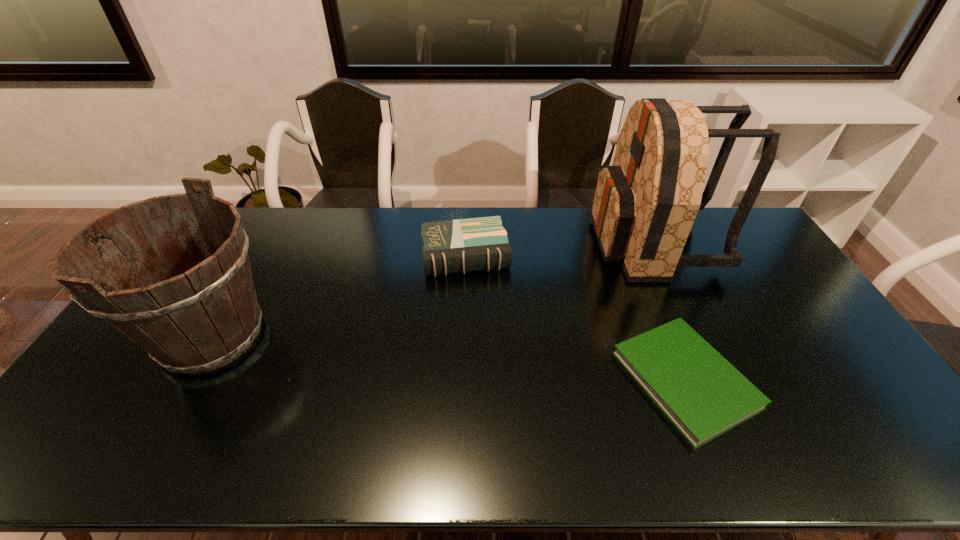
At what (x,y) coordinates should I click in order to perform the action: click on object that stands as the third closest to the third shortest object. Please return your answer as a coordinate pair (x, y). The image size is (960, 540). Looking at the image, I should click on (645, 204).

Where is `free space that satisfies the following two spatial constraints: 1. on the front side of the bucket; 2. on the right side of the shorter paperback book`? This screenshot has height=540, width=960. free space that satisfies the following two spatial constraints: 1. on the front side of the bucket; 2. on the right side of the shorter paperback book is located at coordinates (187, 379).

Where is `vacant region that satisfies the following two spatial constraints: 1. on the front face of the tallest object; 2. on the front side of the nearer paperback book`? The image size is (960, 540). vacant region that satisfies the following two spatial constraints: 1. on the front face of the tallest object; 2. on the front side of the nearer paperback book is located at coordinates (714, 379).

Locate an element on the screen. The image size is (960, 540). free spot that satisfies the following two spatial constraints: 1. on the front face of the tallest object; 2. on the front side of the right paperback book is located at coordinates (714, 379).

Where is `free region that satisfies the following two spatial constraints: 1. on the front face of the tallest object; 2. on the front side of the nearer paperback book`? Image resolution: width=960 pixels, height=540 pixels. free region that satisfies the following two spatial constraints: 1. on the front face of the tallest object; 2. on the front side of the nearer paperback book is located at coordinates (714, 379).